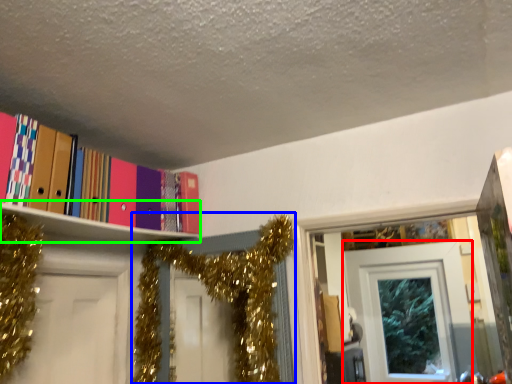
Question: Which object is the closest to the door (highlighted by a red box)? Choose among these: christmas decoration (highlighted by a blue box) or shelf (highlighted by a green box).

Choices:
 (A) christmas decoration
 (B) shelf

Answer: (A)